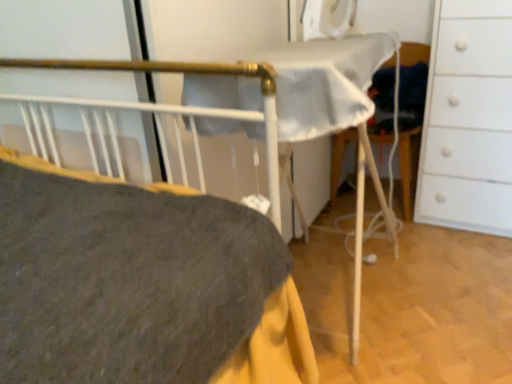
Question: Is white matte chest of drawers at right thinner than white fabric folding chair at center?

Choices:
 (A) no
 (B) yes

Answer: (A)

Question: From the image's perspective, does white matte chest of drawers at right appear lower than white fabric folding chair at center?

Choices:
 (A) no
 (B) yes

Answer: (A)

Question: Does white matte chest of drawers at right have a greater height compared to white fabric folding chair at center?

Choices:
 (A) yes
 (B) no

Answer: (A)

Question: Considering the relative sizes of white matte chest of drawers at right and white fabric folding chair at center in the image provided, is white matte chest of drawers at right smaller than white fabric folding chair at center?

Choices:
 (A) yes
 (B) no

Answer: (B)

Question: Is white matte chest of drawers at right not within white fabric folding chair at center?

Choices:
 (A) yes
 (B) no

Answer: (A)

Question: From a real-world perspective, is white matte chest of drawers at right positioned under white fabric folding chair at center based on gravity?

Choices:
 (A) yes
 (B) no

Answer: (B)

Question: From a real-world perspective, is white fabric folding chair at center located higher than white matte chest of drawers at right?

Choices:
 (A) yes
 (B) no

Answer: (B)

Question: Is white fabric folding chair at center not within white matte chest of drawers at right?

Choices:
 (A) no
 (B) yes

Answer: (B)

Question: Can you confirm if white fabric folding chair at center is smaller than white matte chest of drawers at right?

Choices:
 (A) yes
 (B) no

Answer: (A)

Question: Is white fabric folding chair at center shorter than white matte chest of drawers at right?

Choices:
 (A) yes
 (B) no

Answer: (A)

Question: Does white fabric folding chair at center appear on the left side of white matte chest of drawers at right?

Choices:
 (A) no
 (B) yes

Answer: (B)

Question: Is white fabric folding chair at center placed right next to white matte chest of drawers at right?

Choices:
 (A) no
 (B) yes

Answer: (A)

Question: Looking at the image, does white matte chest of drawers at right seem bigger or smaller compared to white fabric folding chair at center?

Choices:
 (A) big
 (B) small

Answer: (A)